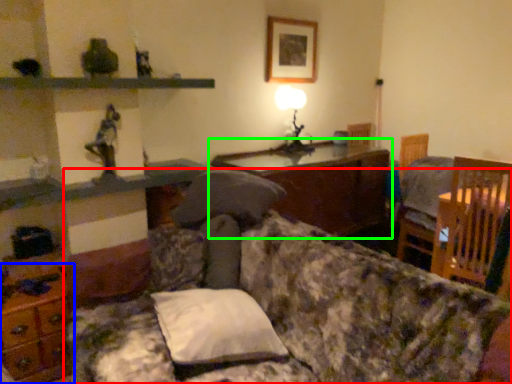
Question: Which object is the farthest from studio couch (highlighted by a red box)? Choose among these: dresser (highlighted by a blue box) or table (highlighted by a green box).

Choices:
 (A) dresser
 (B) table

Answer: (B)